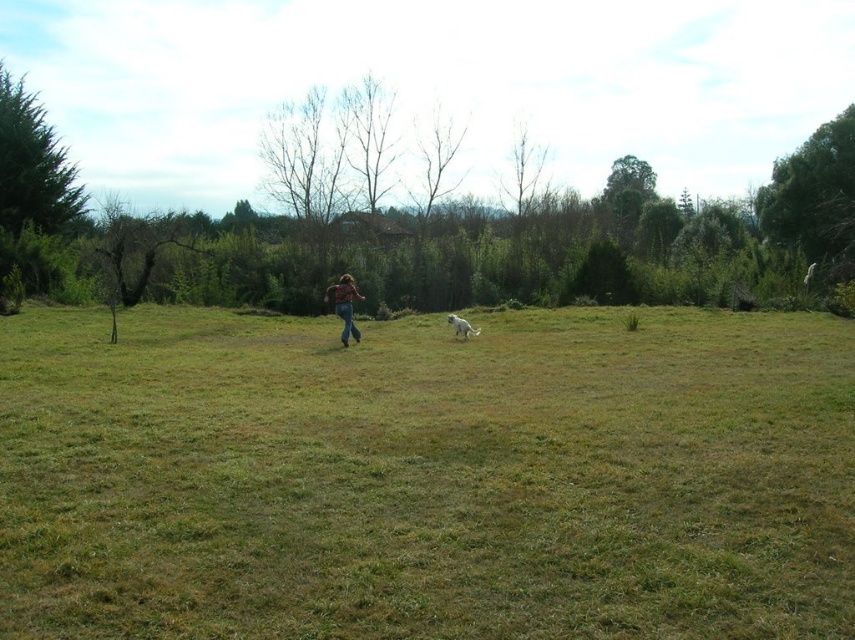
Question: From the image, what is the correct spatial relationship of brown leather jacket at center in relation to white fluffy dog at center?

Choices:
 (A) right
 (B) left

Answer: (B)

Question: Can you confirm if green grass at center is thinner than brown leather jacket at center?

Choices:
 (A) yes
 (B) no

Answer: (B)

Question: Which is nearer to the white fluffy dog at center?

Choices:
 (A) green grass at center
 (B) brown leather jacket at center

Answer: (B)

Question: Which is farther from the white fluffy dog at center?

Choices:
 (A) brown leather jacket at center
 (B) green grass at center

Answer: (B)

Question: Is green grass at center to the left of brown leather jacket at center from the viewer's perspective?

Choices:
 (A) no
 (B) yes

Answer: (A)

Question: Among these objects, which one is farthest from the camera?

Choices:
 (A) brown leather jacket at center
 (B) white fluffy dog at center

Answer: (B)